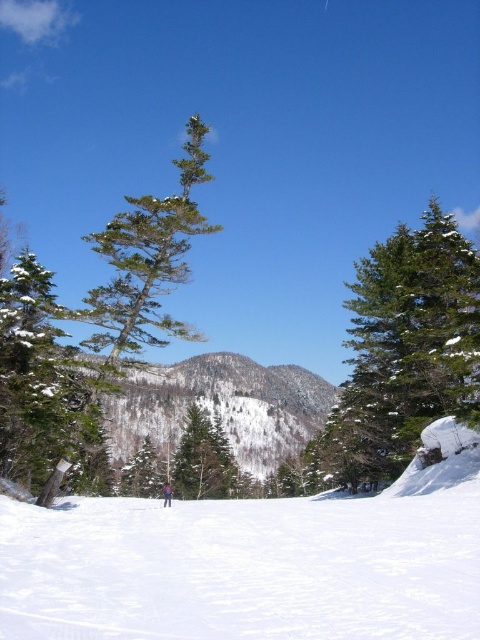
You are planning to take a photo of the white snow ski slope at lower center and the green matte tree at left. Which object should you focus on first if you want to include both in your frame without moving the camera?

The green matte tree at left is larger than the white snow ski slope at lower center, so you should focus on the green matte tree at left first to ensure it fits within the frame while still capturing the smaller ski slope.

You are planning to build a small cabin in the winter landscape. The cabin requires a space wider than the green textured pine tree at right. Is the white snow ski slope at lower center wide enough for this purpose?

The white snow ski slope at lower center is wider than the green textured pine tree at right, so it is wide enough to build the cabin.

You are planning a ski trip and see the white snow ski slope at lower center and the green matte tree at left in the image. Which direction should you head to reach the slope from the tree?

To reach the white snow ski slope at lower center from the green matte tree at left, you should head to the right since the slope is positioned to the right of the tree.